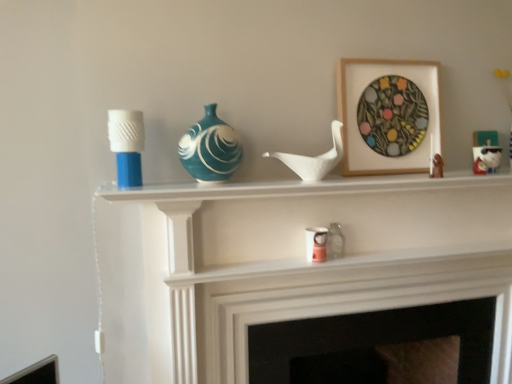
Question: Considering the relative sizes of white matte bird at center, the first toy from the front, and white glossy figurine at upper right, the 1th toy viewed from the back, in the image provided, is white matte bird at center, the first toy from the front, thinner than white glossy figurine at upper right, the 1th toy viewed from the back,?

Choices:
 (A) yes
 (B) no

Answer: (B)

Question: Is white matte bird at center, the first toy from the front, positioned in front of white glossy figurine at upper right, the 1th toy viewed from the back?

Choices:
 (A) no
 (B) yes

Answer: (B)

Question: Does white matte bird at center, arranged as the third toy when viewed from the right, appear on the right side of white glossy figurine at upper right, positioned as the third toy in left-to-right order?

Choices:
 (A) yes
 (B) no

Answer: (B)

Question: Can you confirm if white matte bird at center, the 3th toy when ordered from back to front, is bigger than white glossy figurine at upper right, positioned as the third toy in left-to-right order?

Choices:
 (A) yes
 (B) no

Answer: (A)

Question: Is white matte bird at center, the first toy positioned from the left, not near white glossy figurine at upper right, which is the third toy from front to back?

Choices:
 (A) yes
 (B) no

Answer: (B)

Question: From the image's perspective, is white matte bird at center, the first toy positioned from the left, located beneath white glossy figurine at upper right, which ranks as the first toy in right-to-left order?

Choices:
 (A) no
 (B) yes

Answer: (B)

Question: Is white glossy fireplace at center shorter than matte white fireplace at center?

Choices:
 (A) no
 (B) yes

Answer: (A)

Question: Can you confirm if white glossy fireplace at center is smaller than matte white fireplace at center?

Choices:
 (A) yes
 (B) no

Answer: (A)

Question: From a real-world perspective, is white glossy fireplace at center on matte white fireplace at center?

Choices:
 (A) yes
 (B) no

Answer: (A)

Question: From the image's perspective, does white glossy fireplace at center appear higher than matte white fireplace at center?

Choices:
 (A) no
 (B) yes

Answer: (B)

Question: From a real-world perspective, is white glossy fireplace at center beneath matte white fireplace at center?

Choices:
 (A) yes
 (B) no

Answer: (B)

Question: Is white glossy fireplace at center aimed at matte white fireplace at center?

Choices:
 (A) no
 (B) yes

Answer: (A)

Question: Is teal glossy vase at center smaller than pink paper cup at center, placed as the 2th candle holder when sorted from top to bottom?

Choices:
 (A) no
 (B) yes

Answer: (A)